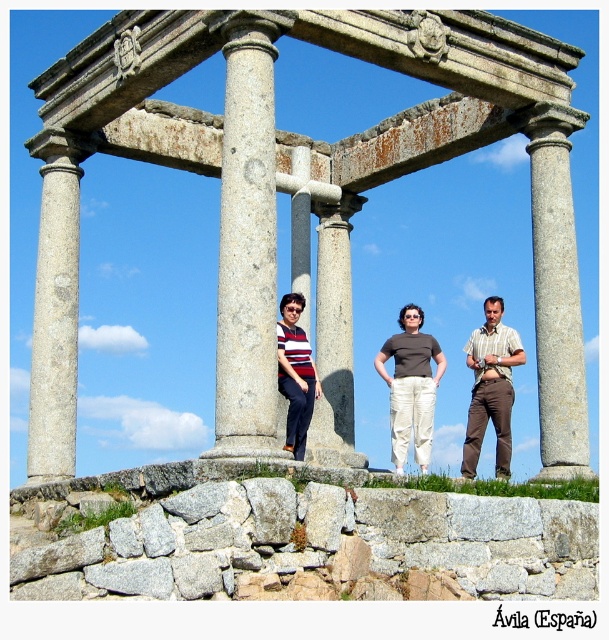
You are standing at the point closest to the ancient stone structure. Which of the two points, point (328,385) or point (438,376), is farther away from you?

Point (328,385) is farther away because it is behind point (438,376), meaning the latter is closer to you.

You are standing at the origin point of a coordinate system placed at the bottom left corner of the image. The gray stone ruins at center are located at coordinates approximately where?

The gray stone ruins at center are located at coordinates approximately 0.314 in the x direction and 0.512 in the y direction.